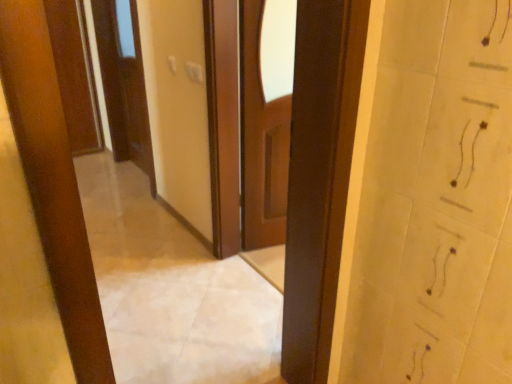
Question: Does wooden door at upper left, which ranks as the 1th door in left-to-right order, have a greater height compared to matte brown door at upper left, the 1th door from the right?

Choices:
 (A) yes
 (B) no

Answer: (B)

Question: Does wooden door at upper left, which ranks as the 1th door in left-to-right order, appear on the left side of matte brown door at upper left, the 1th door from the right?

Choices:
 (A) yes
 (B) no

Answer: (A)

Question: Is wooden door at upper left, which ranks as the 1th door in left-to-right order, positioned far away from matte brown door at upper left, which ranks as the second door in left-to-right order?

Choices:
 (A) yes
 (B) no

Answer: (B)

Question: Is matte brown door at upper left, the 1th door from the right, at the back of wooden door at upper left, the 2th door positioned from the right?

Choices:
 (A) no
 (B) yes

Answer: (A)

Question: Is wooden door at upper left, the 2th door positioned from the right, touching matte brown door at upper left, which ranks as the second door in left-to-right order?

Choices:
 (A) no
 (B) yes

Answer: (A)

Question: Is the position of wooden door at upper left, which ranks as the 1th door in left-to-right order, more distant than that of matte brown door at upper left, which ranks as the second door in left-to-right order?

Choices:
 (A) no
 (B) yes

Answer: (B)

Question: From a real-world perspective, is matte brown door at upper left, the 1th door from the right, physically below wooden door at upper left, the 2th door positioned from the right?

Choices:
 (A) yes
 (B) no

Answer: (B)

Question: Is matte brown door at upper left, which ranks as the second door in left-to-right order, thinner than wooden door at upper left, the 2th door positioned from the right?

Choices:
 (A) yes
 (B) no

Answer: (B)

Question: Is matte brown door at upper left, the 1th door from the right, aimed at wooden door at upper left, the 2th door positioned from the right?

Choices:
 (A) yes
 (B) no

Answer: (B)

Question: Does matte brown door at upper left, the 1th door from the right, have a larger size compared to wooden door at upper left, which ranks as the 1th door in left-to-right order?

Choices:
 (A) no
 (B) yes

Answer: (B)

Question: Is the depth of matte brown door at upper left, the 1th door from the right, less than that of wooden door at upper left, which ranks as the 1th door in left-to-right order?

Choices:
 (A) yes
 (B) no

Answer: (A)

Question: From the image's perspective, does matte brown door at upper left, which ranks as the second door in left-to-right order, appear higher than wooden door at upper left, the 2th door positioned from the right?

Choices:
 (A) yes
 (B) no

Answer: (B)

Question: Considering the positions of wooden door at upper left, which ranks as the 1th door in left-to-right order, and matte brown door at upper left, which ranks as the second door in left-to-right order, in the image, is wooden door at upper left, which ranks as the 1th door in left-to-right order, wider or thinner than matte brown door at upper left, which ranks as the second door in left-to-right order,?

Choices:
 (A) thin
 (B) wide

Answer: (A)